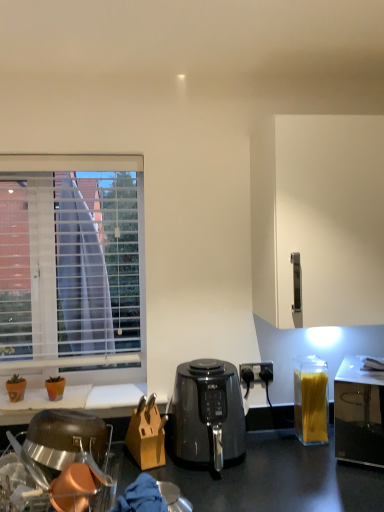
Question: Does stainless steel dish rack at lower left have a lesser width compared to transparent plastic container of spaghetti at right?

Choices:
 (A) no
 (B) yes

Answer: (A)

Question: Would you say transparent plastic container of spaghetti at right is part of stainless steel dish rack at lower left's contents?

Choices:
 (A) no
 (B) yes

Answer: (A)

Question: Is stainless steel dish rack at lower left turned away from transparent plastic container of spaghetti at right?

Choices:
 (A) yes
 (B) no

Answer: (B)

Question: Is stainless steel dish rack at lower left not near transparent plastic container of spaghetti at right?

Choices:
 (A) no
 (B) yes

Answer: (A)

Question: Is stainless steel dish rack at lower left shorter than transparent plastic container of spaghetti at right?

Choices:
 (A) no
 (B) yes

Answer: (B)

Question: Looking at their shapes, would you say wooden knife block at center is wider or thinner than white matte cabinet at right?

Choices:
 (A) thin
 (B) wide

Answer: (A)

Question: From the image's perspective, relative to white matte cabinet at right, is wooden knife block at center above or below?

Choices:
 (A) above
 (B) below

Answer: (B)

Question: In the image, is wooden knife block at center positioned in front of or behind white matte cabinet at right?

Choices:
 (A) front
 (B) behind

Answer: (B)

Question: Is wooden knife block at center taller or shorter than white matte cabinet at right?

Choices:
 (A) short
 (B) tall

Answer: (A)

Question: Do you think white matte cabinet at right is within black plastic air fryer at center, or outside of it?

Choices:
 (A) inside
 (B) outside

Answer: (B)

Question: Is white matte cabinet at right taller or shorter than black plastic air fryer at center?

Choices:
 (A) tall
 (B) short

Answer: (A)

Question: Looking at the image, does white matte cabinet at right seem bigger or smaller compared to black plastic air fryer at center?

Choices:
 (A) big
 (B) small

Answer: (A)

Question: Is point (281, 268) positioned closer to the camera than point (223, 421)?

Choices:
 (A) farther
 (B) closer

Answer: (B)

Question: In terms of size, does transparent plastic container of spaghetti at right appear bigger or smaller than white matte cabinet at right?

Choices:
 (A) small
 (B) big

Answer: (A)

Question: Is transparent plastic container of spaghetti at right to the left or to the right of white matte cabinet at right in the image?

Choices:
 (A) left
 (B) right

Answer: (B)